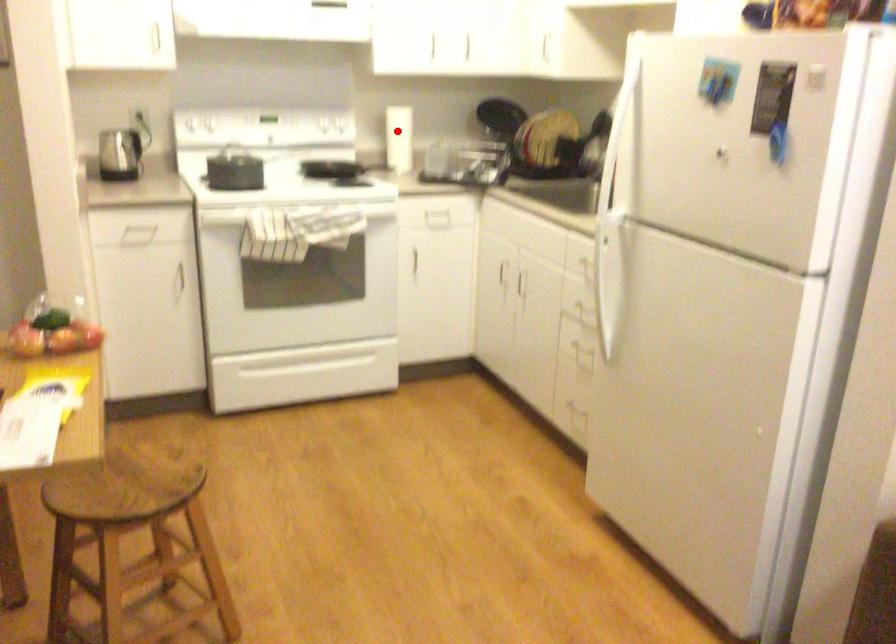
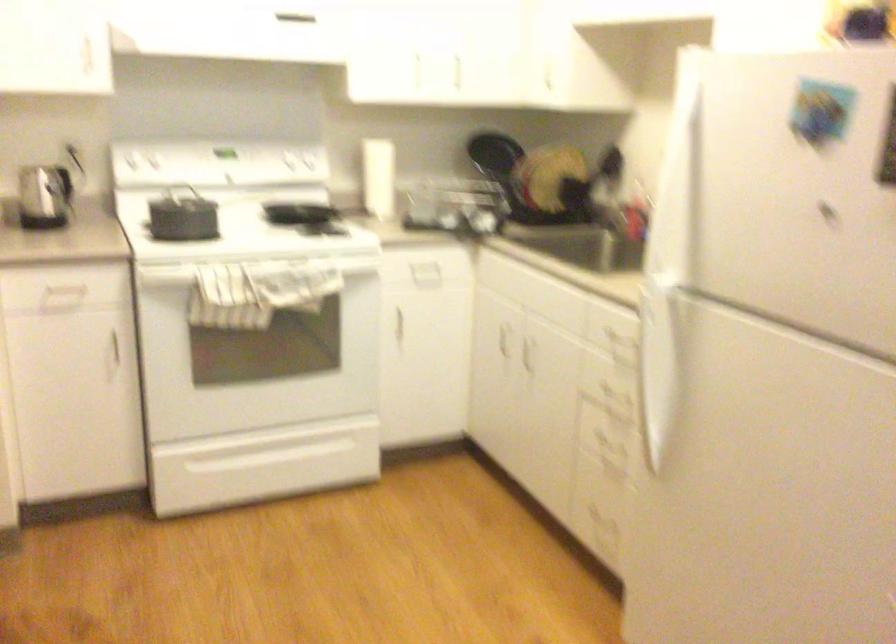
Question: I am providing you with two images of the same scene from different viewpoints. In image1, a red point is highlighted. Considering the same 3D point in image2, which of the following is correct?

Choices:
 (A) It is closer
 (B) It is farther

Answer: (A)